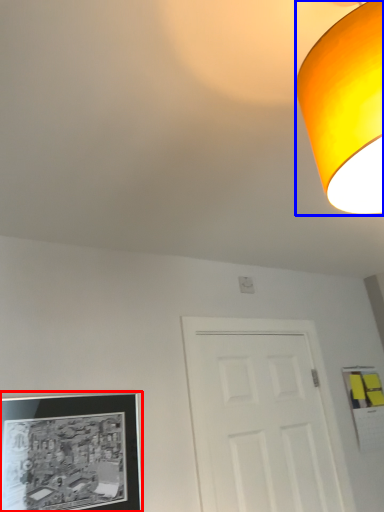
Question: Which point is further to the camera, picture frame (highlighted by a red box) or lamp (highlighted by a blue box)?

Choices:
 (A) picture frame
 (B) lamp

Answer: (A)